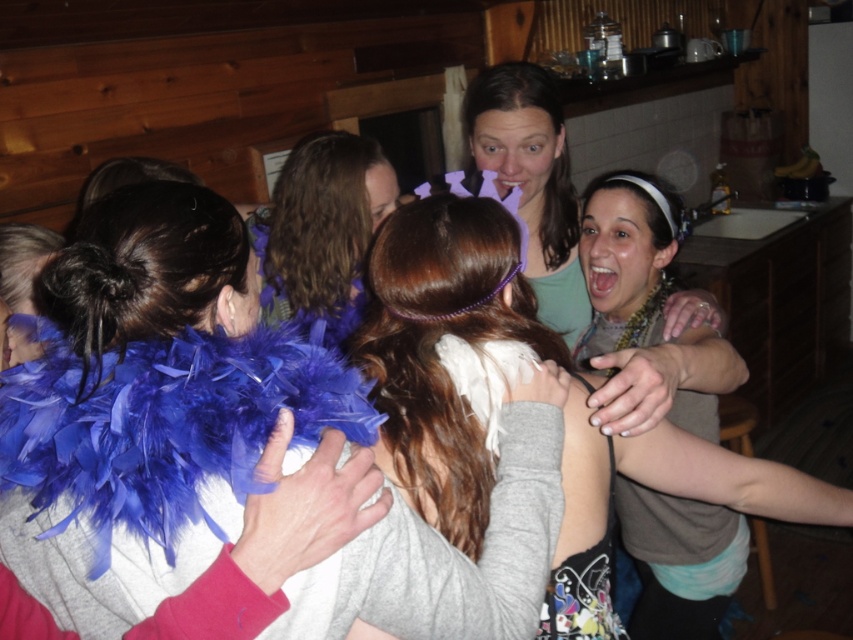
Question: Which object is positioned farthest from the blue feather boa at center?

Choices:
 (A) purple feather boa at center
 (B) matte purple headband at upper center
 (C) matte black tank top at center
 (D) white feather boa at center

Answer: (A)

Question: Does matte black tank top at center have a greater width compared to matte purple headband at upper center?

Choices:
 (A) no
 (B) yes

Answer: (B)

Question: Among these points, which one is nearest to the camera?

Choices:
 (A) (560, 177)
 (B) (339, 204)

Answer: (B)

Question: In this image, where is matte purple headband at upper center located relative to purple feather boa at center?

Choices:
 (A) above
 (B) below

Answer: (B)

Question: Which object is closer to the camera taking this photo?

Choices:
 (A) purple feather boa at center
 (B) matte purple headband at upper center

Answer: (B)

Question: Is blue feather boa at center positioned before purple feather boa at center?

Choices:
 (A) no
 (B) yes

Answer: (B)